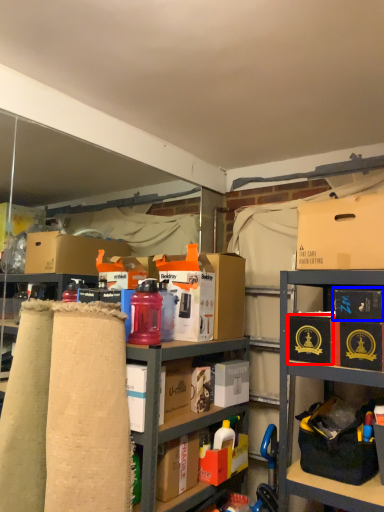
Question: Among these objects, which one is nearest to the camera, box (highlighted by a red box) or box (highlighted by a blue box)?

Choices:
 (A) box
 (B) box

Answer: (B)